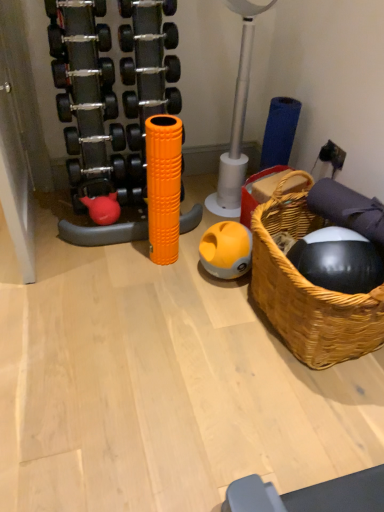
I want to click on free space to the left of yellow matte ball at center, so click(x=185, y=273).